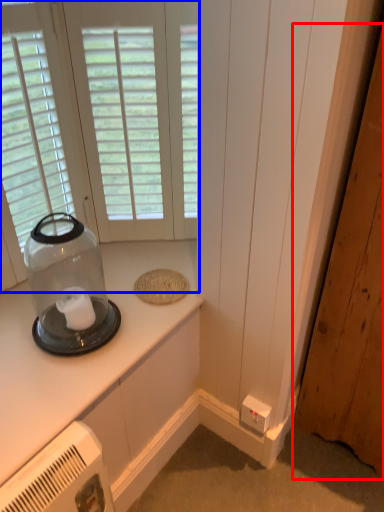
Question: Which object is further to the camera taking this photo, door (highlighted by a red box) or window (highlighted by a blue box)?

Choices:
 (A) door
 (B) window

Answer: (B)